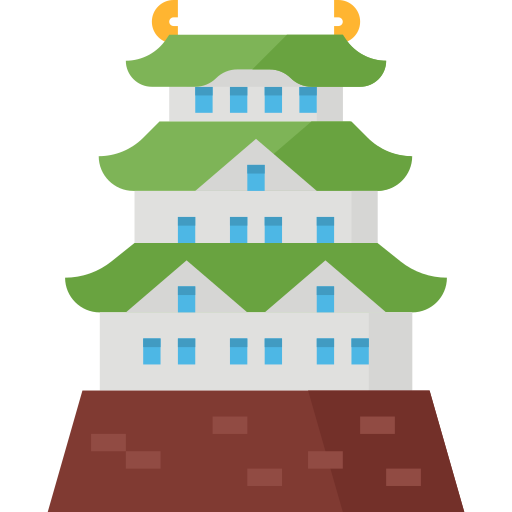
Find the location of `3rd floor windows`. 3rd floor windows is located at coordinates (209, 104), (234, 104), (271, 103), (304, 106).